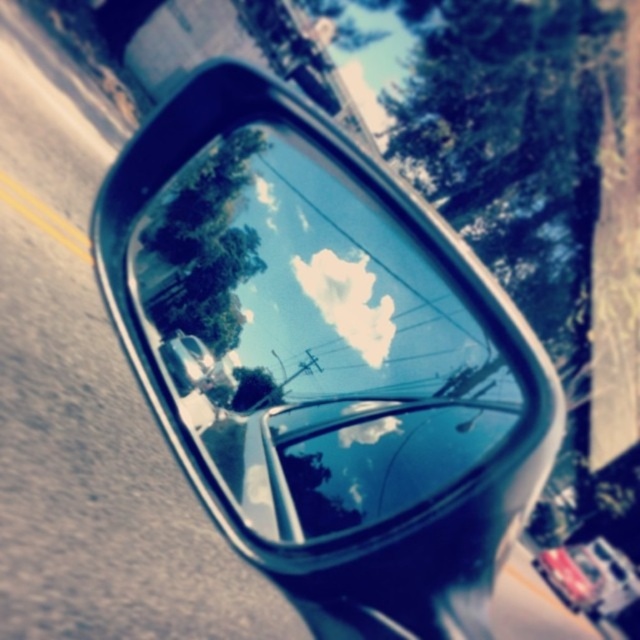
Question: Does glossy metallic side mirror at upper center lie in front of metallic red car at lower right?

Choices:
 (A) no
 (B) yes

Answer: (B)

Question: Which of the following is the closest to the observer?

Choices:
 (A) metallic red car at lower right
 (B) glossy metallic side mirror at upper center

Answer: (B)

Question: Which point is farther from the camera taking this photo?

Choices:
 (A) (548, 572)
 (B) (449, 468)

Answer: (A)

Question: Does glossy metallic side mirror at upper center have a smaller size compared to metallic red car at lower right?

Choices:
 (A) yes
 (B) no

Answer: (B)

Question: Can you confirm if glossy metallic side mirror at upper center is positioned above metallic red car at lower right?

Choices:
 (A) no
 (B) yes

Answer: (B)